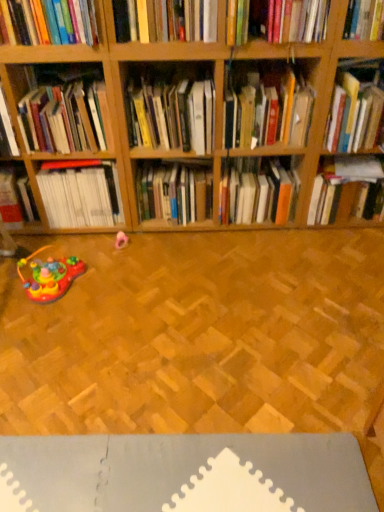
Image resolution: width=384 pixels, height=512 pixels. Describe the element at coordinates (81, 196) in the screenshot. I see `white matte book at left, the second book from the left` at that location.

Identify the location of gray foam mat at lower center. (185, 473).

Describe the element at coordinates (185, 473) in the screenshot. This screenshot has height=512, width=384. I see `gray foam mat at lower center` at that location.

The image size is (384, 512). I want to click on hardcover book at upper right, marked as the twelfth book in a left-to-right arrangement, so click(356, 106).

In order to face rubberized plastic toy at lower left, which is counted as the 1th toy, starting from the left, should I rotate leftwards or rightwards?

To face it directly, rotate left by 18.107 degrees.

What are the coordinates of `white matte book at left, the second book from the left` in the screenshot? It's located at (81, 196).

Which point is more distant from viewer, (x=354, y=508) or (x=123, y=237)?

Positioned behind is point (x=123, y=237).

Who is smaller, gray foam mat at lower center or pink rubber duck at center, the 1th toy from the back?

pink rubber duck at center, the 1th toy from the back, is smaller.

Considering the positions of objects gray foam mat at lower center and pink rubber duck at center, which is counted as the 2th toy, starting from the front, in the image provided, who is in front, gray foam mat at lower center or pink rubber duck at center, which is counted as the 2th toy, starting from the front,?

gray foam mat at lower center is more forward.

From a real-world perspective, does pink rubber duck at center, the 1th toy from the back, sit lower than hardcover book at upper right, the third book in the right-to-left sequence?

Yes.

Does pink rubber duck at center, which is counted as the 1th toy, starting from the right, turn towards hardcover book at upper right, the tenth book positioned from the left?

No, pink rubber duck at center, which is counted as the 1th toy, starting from the right, is not facing towards hardcover book at upper right, the tenth book positioned from the left.

Is pink rubber duck at center, which is counted as the 2th toy, starting from the front, taller than hardcover book at upper right, the tenth book positioned from the left?

No, pink rubber duck at center, which is counted as the 2th toy, starting from the front, is not taller than hardcover book at upper right, the tenth book positioned from the left.

Between hardcover book at center, placed as the 4th book when sorted from left to right, and hardcover book at center, arranged as the eighth book when viewed from the left, which one appears on the right side from the viewer's perspective?

Positioned to the right is hardcover book at center, arranged as the eighth book when viewed from the left.

Between hardcover book at center, placed as the 4th book when sorted from left to right, and hardcover book at center, arranged as the eighth book when viewed from the left, which one has smaller size?

hardcover book at center, placed as the 4th book when sorted from left to right.

Is hardcover book at center, the ninth book in the right-to-left sequence, thinner than hardcover book at center, which is the fifth book in right-to-left order?

Yes.

Is hardcover book at center, the ninth book in the right-to-left sequence, beside hardcover book at center, arranged as the eighth book when viewed from the left?

No, hardcover book at center, the ninth book in the right-to-left sequence, is not next to hardcover book at center, arranged as the eighth book when viewed from the left.

From a real-world perspective, is hardcover book at upper left, the third book when ordered from left to right, physically located above or below hardcover book at center, which is the fifth book in right-to-left order?

From a real-world perspective, hardcover book at upper left, the third book when ordered from left to right, is physically above hardcover book at center, which is the fifth book in right-to-left order.

Which object is positioned more to the left, hardcover book at upper left, which appears as the tenth book when viewed from the right, or hardcover book at center, arranged as the eighth book when viewed from the left?

hardcover book at upper left, which appears as the tenth book when viewed from the right, is more to the left.

From the image's perspective, is hardcover book at upper left, which appears as the tenth book when viewed from the right, located beneath hardcover book at center, which is the fifth book in right-to-left order?

No.

Does hardcover book at upper left, the third book when ordered from left to right, come behind hardcover book at center, which is the fifth book in right-to-left order?

No, hardcover book at upper left, the third book when ordered from left to right, is in front of hardcover book at center, which is the fifth book in right-to-left order.

From a real-world perspective, is rubberized plastic toy at lower left, the 1th toy when ordered from bottom to top, physically located above or below pink rubber duck at center, which is the first toy in top-to-bottom order?

rubberized plastic toy at lower left, the 1th toy when ordered from bottom to top, is above pink rubber duck at center, which is the first toy in top-to-bottom order.

Would you say pink rubber duck at center, which is counted as the 1th toy, starting from the right, is part of rubberized plastic toy at lower left, positioned as the 2th toy in back-to-front order,'s contents?

Actually, pink rubber duck at center, which is counted as the 1th toy, starting from the right, is outside rubberized plastic toy at lower left, positioned as the 2th toy in back-to-front order.

Between rubberized plastic toy at lower left, the 1th toy when ordered from bottom to top, and pink rubber duck at center, which is the first toy in top-to-bottom order, which one has larger width?

With larger width is rubberized plastic toy at lower left, the 1th toy when ordered from bottom to top.

Between hardcover book at left, the 1th book viewed from the left, and rubberized plastic toy at lower left, the 1th toy when ordered from front to back, which one appears on the right side from the viewer's perspective?

Positioned to the right is hardcover book at left, the 1th book viewed from the left.

Is hardcover book at left, which appears as the twelfth book when viewed from the right, bigger than rubberized plastic toy at lower left, positioned as the 2th toy in back-to-front order?

Indeed, hardcover book at left, which appears as the twelfth book when viewed from the right, has a larger size compared to rubberized plastic toy at lower left, positioned as the 2th toy in back-to-front order.

What's the angular difference between hardcover book at left, the 1th book viewed from the left, and rubberized plastic toy at lower left, the 1th toy when ordered from bottom to top,'s facing directions?

They differ by 0.0513 degrees in their facing directions.

From the picture: From the image's perspective, is hardcover book at left, the 1th book viewed from the left, located above rubberized plastic toy at lower left, the second toy from the right?

Yes, from the image's perspective, hardcover book at left, the 1th book viewed from the left, is above rubberized plastic toy at lower left, the second toy from the right.

From a real-world perspective, is rubberized plastic toy at lower left, which appears as the 2th toy when viewed from the top, positioned over hardcover book at upper left, the third book when ordered from left to right, based on gravity?

No.

Between rubberized plastic toy at lower left, which is counted as the 1th toy, starting from the left, and hardcover book at upper left, the third book when ordered from left to right, which one is positioned behind?

rubberized plastic toy at lower left, which is counted as the 1th toy, starting from the left, is further away from the camera.

Could you tell me if rubberized plastic toy at lower left, which is counted as the 1th toy, starting from the left, is facing hardcover book at upper left, which appears as the tenth book when viewed from the right?

No, rubberized plastic toy at lower left, which is counted as the 1th toy, starting from the left, is not facing towards hardcover book at upper left, which appears as the tenth book when viewed from the right.

Can you confirm if rubberized plastic toy at lower left, which appears as the 2th toy when viewed from the top, is wider than hardcover book at upper left, the third book when ordered from left to right?

No.

The image size is (384, 512). I want to click on surface below the pink rubber duck at center, the 1th toy from the back (from the image's perspective), so click(185, 473).

Which toy is the 2nd one when counting from the back of the hardcover book at upper right, the third book in the right-to-left sequence? Please provide its 2D coordinates.

[(121, 240)]

Estimate the real-world distances between objects in this image. Which object is closer to rubberized plastic toy at lower left, which appears as the 2th toy when viewed from the top, hardcover book at center, the 6th book when ordered from left to right, or hardcover book at center, the ninth book in the right-to-left sequence?

hardcover book at center, the 6th book when ordered from left to right, is closer to rubberized plastic toy at lower left, which appears as the 2th toy when viewed from the top.

Based on their spatial positions, is hardcover book at upper right, the third book in the right-to-left sequence, or hardcover book at left, the 1th book viewed from the left, further from hardcover book at upper left, which appears as the tenth book when viewed from the right?

Based on the image, hardcover book at upper right, the third book in the right-to-left sequence, appears to be further to hardcover book at upper left, which appears as the tenth book when viewed from the right.

Based on their spatial positions, is hardcover book at upper left, which appears as the tenth book when viewed from the right, or pink rubber duck at center, the second toy from the left, closer to hardcover book at center, placed as the 4th book when sorted from left to right?

hardcover book at upper left, which appears as the tenth book when viewed from the right, lies closer to hardcover book at center, placed as the 4th book when sorted from left to right, than the other object.

Looking at the image, which one is located closer to hardcover book at center, arranged as the eighth book when viewed from the left, rubberized plastic toy at lower left, positioned as the 2th toy in back-to-front order, or hardcover book at upper center, acting as the seventh book starting from the left?

Based on the image, hardcover book at upper center, acting as the seventh book starting from the left, appears to be nearer to hardcover book at center, arranged as the eighth book when viewed from the left.

From the image, which object appears to be nearer to hardcover book at upper center, which ranks as the 5th book in left-to-right order, hardcover book at center, arranged as the eighth book when viewed from the left, or hardcover book at upper center, which is the 6th book from right to left?

The object closer to hardcover book at upper center, which ranks as the 5th book in left-to-right order, is hardcover book at upper center, which is the 6th book from right to left.

Estimate the real-world distances between objects in this image. Which object is closer to hardcover book at left, which appears as the twelfth book when viewed from the right, pink rubber duck at center, which is counted as the 1th toy, starting from the right, or hardcover book at center, arranged as the eighth book when viewed from the left?

pink rubber duck at center, which is counted as the 1th toy, starting from the right, lies closer to hardcover book at left, which appears as the twelfth book when viewed from the right, than the other object.

From the picture: When comparing their distances from hardcover book at center, which ranks as the 4th book in right-to-left order, does hardcover book at center, which ranks as the seventh book in right-to-left order, or rubberized plastic toy at lower left, the 1th toy when ordered from front to back, seem further?

rubberized plastic toy at lower left, the 1th toy when ordered from front to back.

Which object lies nearer to the anchor point pink rubber duck at center, which is the first toy in top-to-bottom order, hardcover book at center, the ninth book in the right-to-left sequence, or hardcover book at upper left, the third book when ordered from left to right?

hardcover book at center, the ninth book in the right-to-left sequence, is positioned closer to the anchor pink rubber duck at center, which is the first toy in top-to-bottom order.

Where is `toy between rubberized plastic toy at lower left, positioned as the 2th toy in back-to-front order, and hardcover book at upper right, marked as the twelfth book in a left-to-right arrangement, from left to right`? Image resolution: width=384 pixels, height=512 pixels. toy between rubberized plastic toy at lower left, positioned as the 2th toy in back-to-front order, and hardcover book at upper right, marked as the twelfth book in a left-to-right arrangement, from left to right is located at coordinates (121, 240).

In order to click on toy located between rubberized plastic toy at lower left, positioned as the 2th toy in back-to-front order, and hardcover book at upper right, placed as the eleventh book when sorted from left to right, in the left-right direction in this screenshot , I will do `click(121, 240)`.

Where is `toy between hardcover book at upper center, acting as the seventh book starting from the left, and rubberized plastic toy at lower left, positioned as the 2th toy in back-to-front order, from top to bottom`? toy between hardcover book at upper center, acting as the seventh book starting from the left, and rubberized plastic toy at lower left, positioned as the 2th toy in back-to-front order, from top to bottom is located at coordinates (121, 240).

Where is `toy between rubberized plastic toy at lower left, the 1th toy when ordered from front to back, and hardcover book at center, which is the fifth book in right-to-left order, from left to right`? This screenshot has height=512, width=384. toy between rubberized plastic toy at lower left, the 1th toy when ordered from front to back, and hardcover book at center, which is the fifth book in right-to-left order, from left to right is located at coordinates (121, 240).